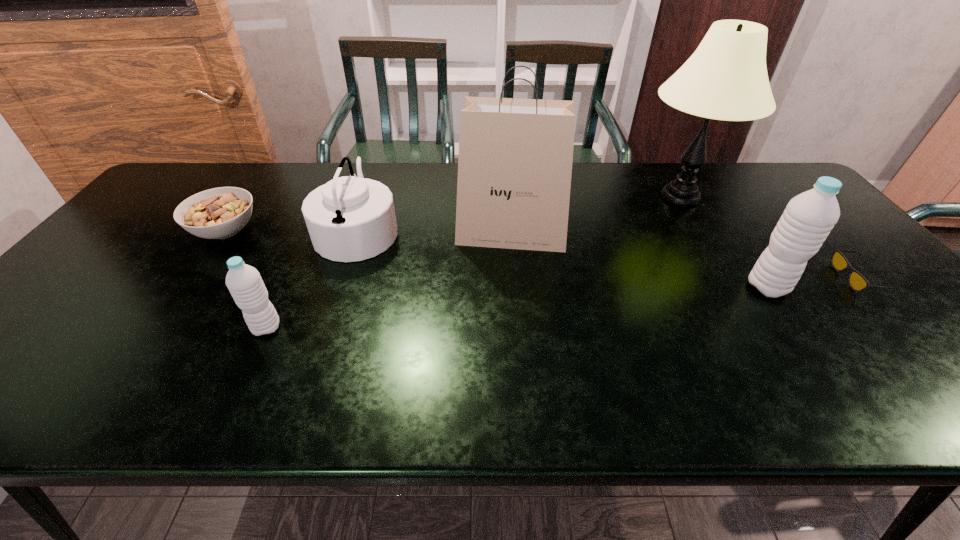
Please point a space for a new water_bottle to maintain equal intervals. Please provide its 2D coordinates. Your answer should be formatted as a tuple, i.e. [(x, y)], where the tuple contains the x and y coordinates of a point satisfying the conditions above.

[(528, 307)]